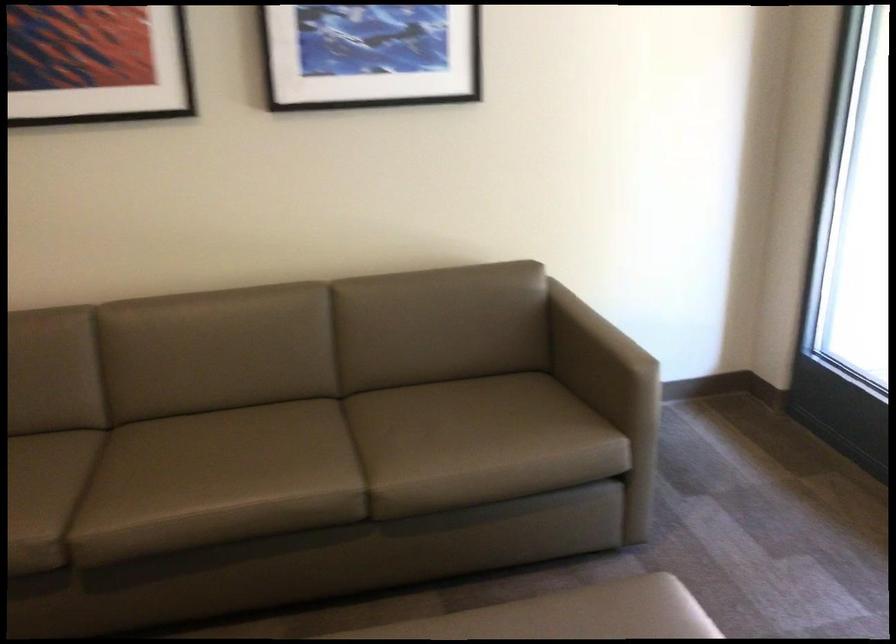
Describe the element at coordinates (356, 450) in the screenshot. I see `a brown sofa sitting surface` at that location.